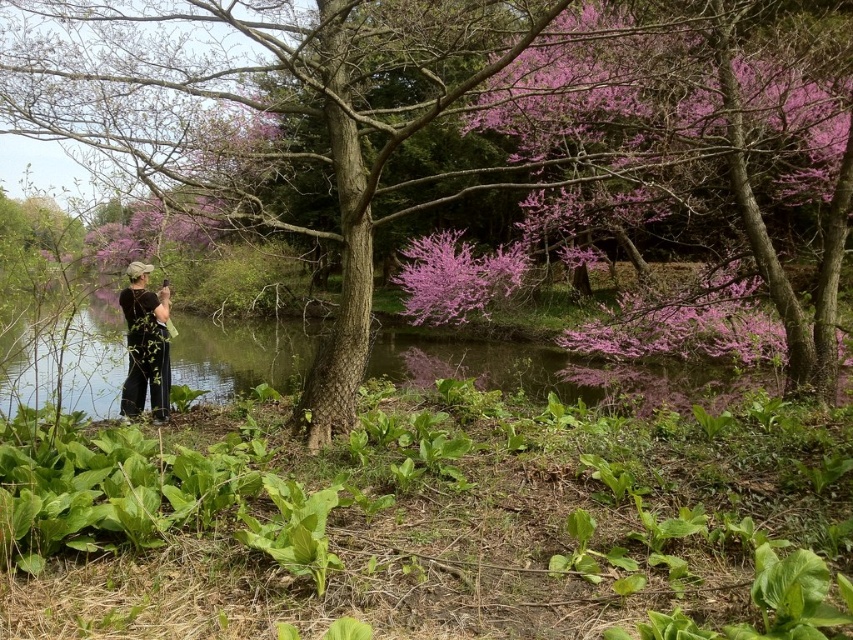
You are a photographer trying to capture a photo of the smooth bark tree at center and the black cotton shirt at center. Which object should you focus on first if you want to ensure both are in focus?

The smooth bark tree at center is much taller than the black cotton shirt at center, so you should focus on the smooth bark tree at center first to ensure both are in focus.

From the picture: You are standing at the edge of the water and want to pick the pink bloom at center. Can you reach it without getting your feet wet?

The pink bloom at center is 16.50 meters away from viewer, so you can easily reach it without getting your feet wet since it is quite far from the water edge.

You are a hiker who wants to take a photo of the smooth bark tree at center without the black cotton shirt at center blocking the view. Is the tree visible from your current position?

The smooth bark tree at center is located above the black cotton shirt at center, so yes, the tree is visible from your current position as it is positioned higher up and not obstructed by the shirt.